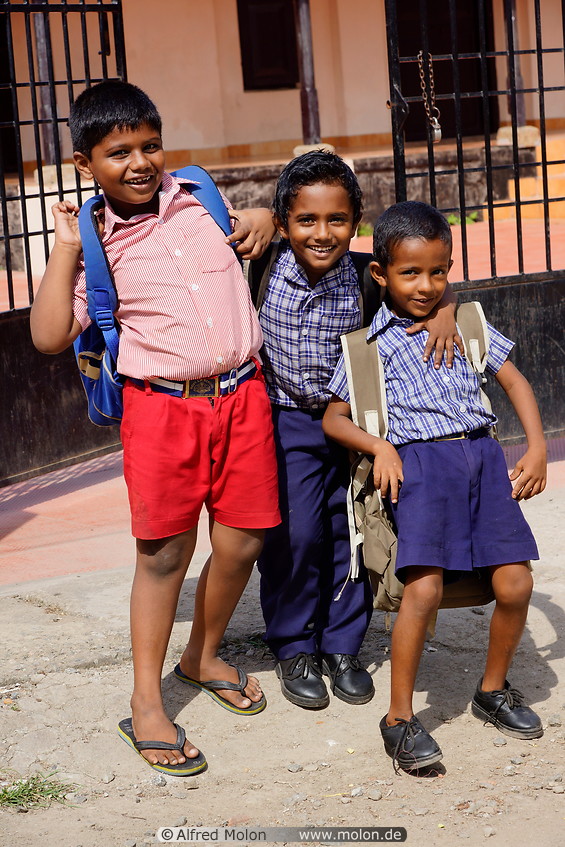
Find the location of a particular element. The height and width of the screenshot is (847, 565). lock is located at coordinates click(437, 130).